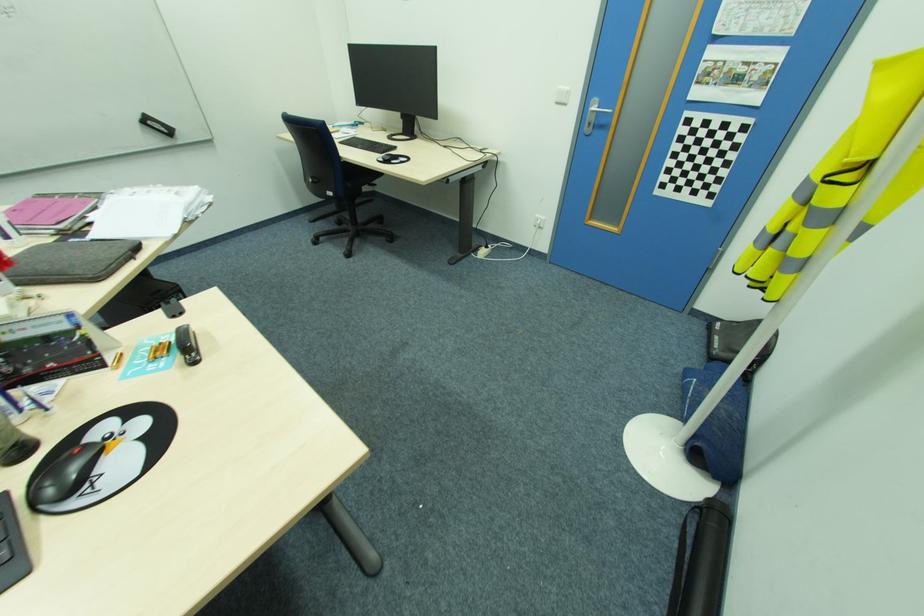
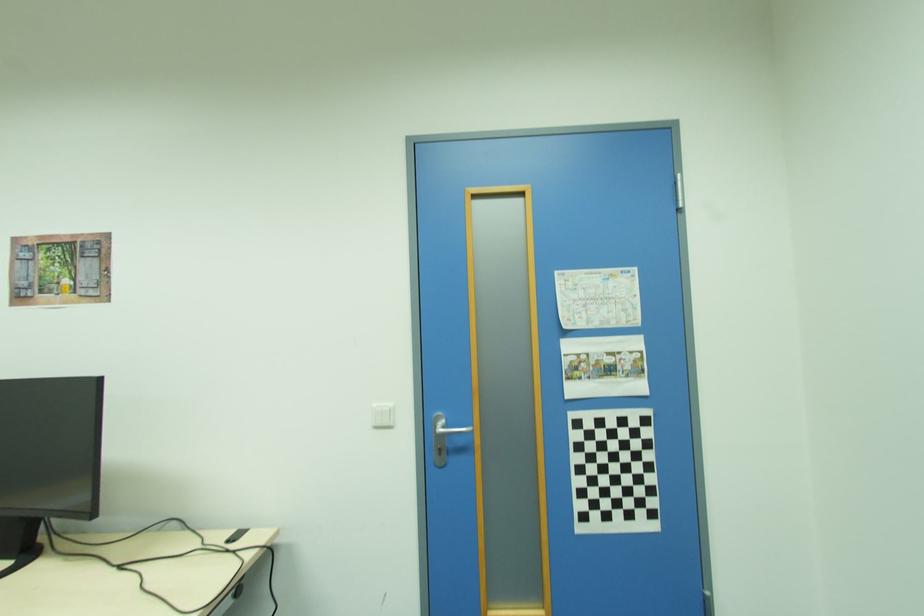
Find the pixel in the second image that matches [713,196] in the first image.

(655, 515)